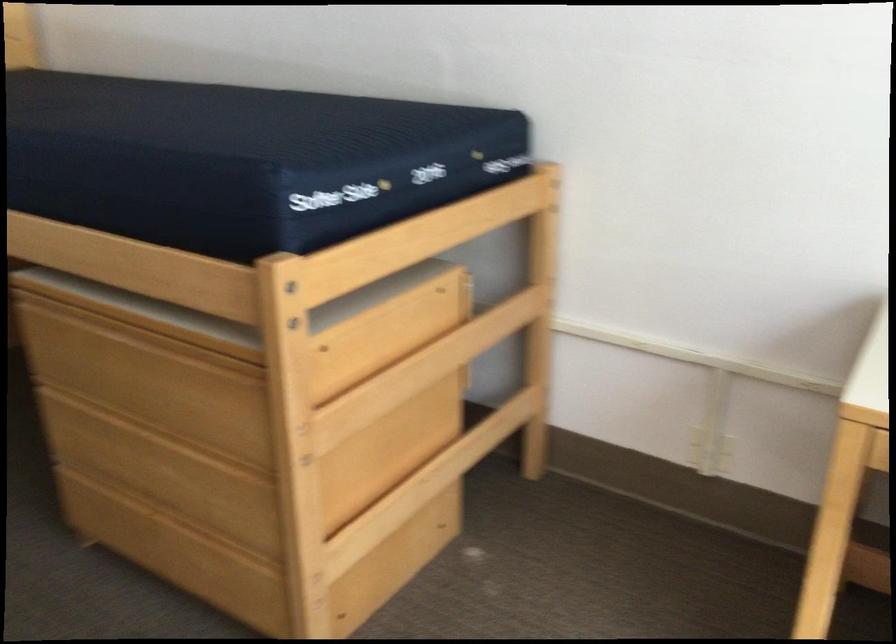
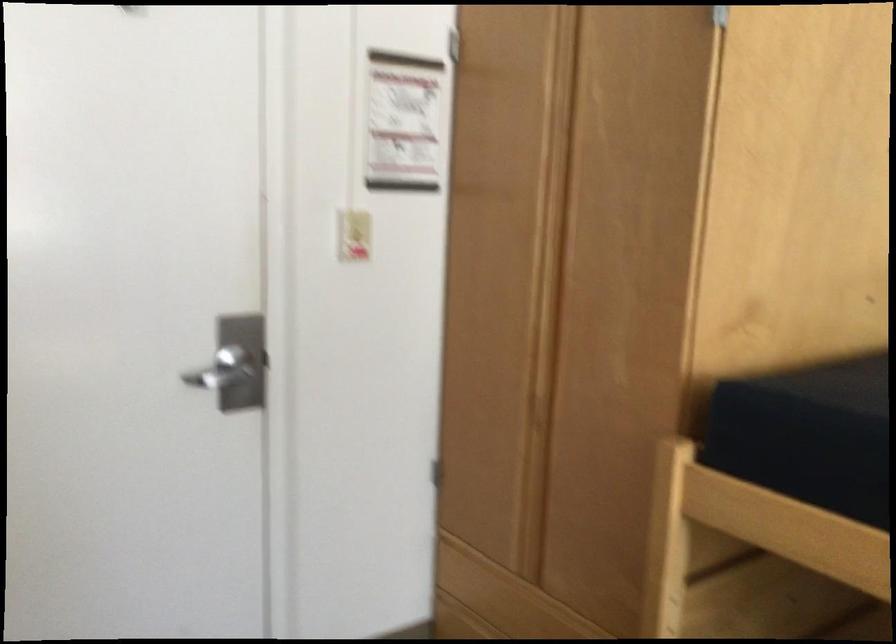
In a continuous first-person perspective shot, in which direction is the camera moving?

The movement direction of the cameraman is left, forward.